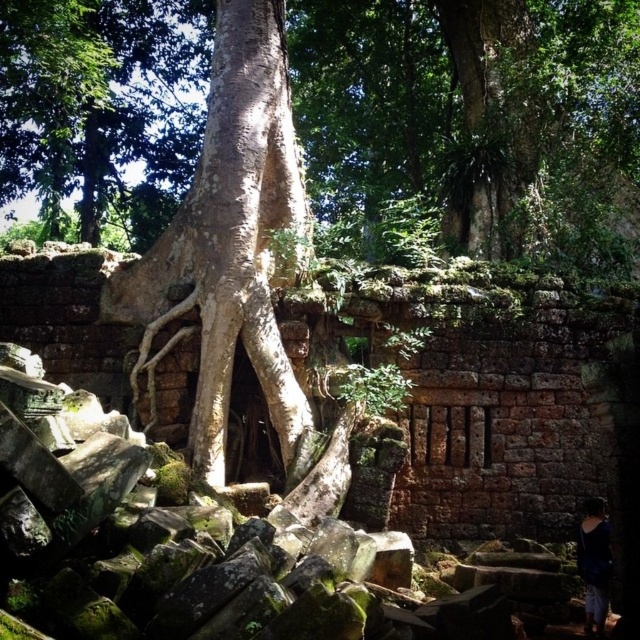
Which is behind, point (136, 52) or point (593, 515)?

Point (136, 52)

Between point (566, 168) and point (602, 506), which one is positioned in front?

Point (602, 506) is in front.

The width and height of the screenshot is (640, 640). I want to click on smooth bark tree at center, so click(472, 125).

Is point (109, 289) behind point (589, 504)?

Yes, it is behind point (589, 504).

Can you confirm if white rough tree trunk at center is taller than dark blue fabric at lower right?

In fact, white rough tree trunk at center may be shorter than dark blue fabric at lower right.

Is point (243, 168) behind point (595, 547)?

That is True.

Identify the location of white rough tree trunk at center. The image size is (640, 640). (228, 237).

Does smooth bark tree at center have a greater width compared to white rough tree trunk at center?

Yes.

Looking at this image, can you confirm if smooth bark tree at center is positioned to the left of white rough tree trunk at center?

No, smooth bark tree at center is not to the left of white rough tree trunk at center.

Locate an element on the screen. smooth bark tree at center is located at coordinates (472, 125).

At what (x,y) coordinates should I click in order to perform the action: click on smooth bark tree at center. Please return your answer as a coordinate pair (x, y). Image resolution: width=640 pixels, height=640 pixels. Looking at the image, I should click on (472, 125).